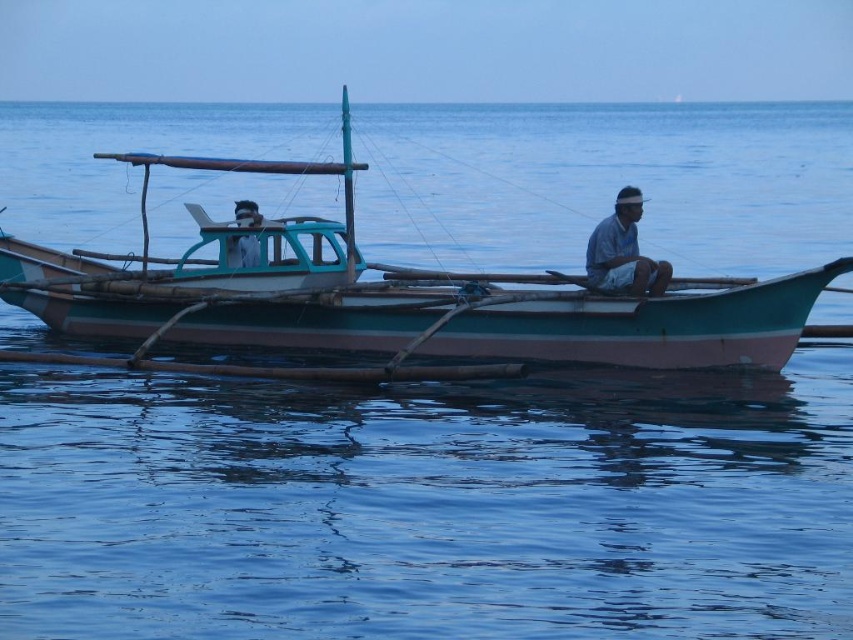
Can you confirm if teal wooden boat at center is positioned to the right of white woven hat at center?

Incorrect, teal wooden boat at center is not on the right side of white woven hat at center.

Is teal wooden boat at center to the left of white woven hat at center from the viewer's perspective?

Yes, teal wooden boat at center is to the left of white woven hat at center.

This screenshot has width=853, height=640. Identify the location of teal wooden boat at center. (404, 305).

Locate an element on the screen. teal wooden boat at center is located at coordinates 404,305.

Who is more forward, (633, 278) or (236, 204)?

Point (633, 278) is more forward.

Is white woven hat at center behind matte blue shirt at center?

No.

Is point (651, 262) farther from camera compared to point (239, 221)?

That is False.

Where is `white woven hat at center`? white woven hat at center is located at coordinates (624, 252).

Does teal wooden boat at center lie in front of matte blue shirt at center?

That is True.

Can you confirm if teal wooden boat at center is positioned below matte blue shirt at center?

Incorrect, teal wooden boat at center is not positioned below matte blue shirt at center.

Locate an element on the screen. The image size is (853, 640). teal wooden boat at center is located at coordinates (404, 305).

You are a GUI agent. You are given a task and a screenshot of the screen. Output one action in this format:
    pyautogui.click(x=<x>, y=<y>)
    Task: Click on the teal wooden boat at center
    This screenshot has width=853, height=640.
    Given the screenshot: What is the action you would take?
    pyautogui.click(x=404, y=305)